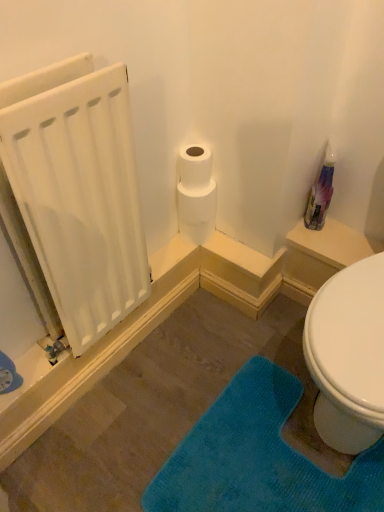
Question: In the image, is translucent plastic spray bottle at upper right positioned in front of or behind teal plush bath mat at lower right?

Choices:
 (A) front
 (B) behind

Answer: (B)

Question: Is point (312, 198) positioned closer to the camera than point (223, 493)?

Choices:
 (A) farther
 (B) closer

Answer: (A)

Question: Considering the real-world distances, which object is closest to the white matte radiator at left?

Choices:
 (A) white matte toilet paper at upper center
 (B) teal plush bath mat at lower right
 (C) translucent plastic spray bottle at upper right

Answer: (A)

Question: Estimate the real-world distances between objects in this image. Which object is farther from the white matte toilet paper at upper center?

Choices:
 (A) white matte radiator at left
 (B) teal plush bath mat at lower right
 (C) translucent plastic spray bottle at upper right

Answer: (B)